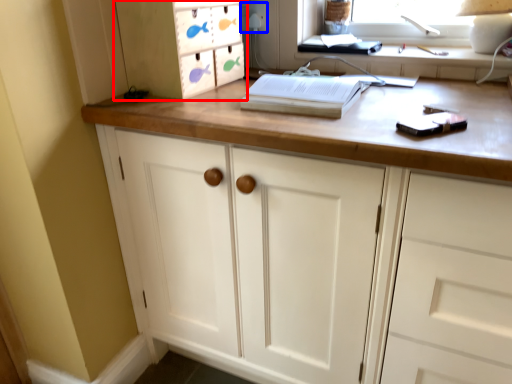
Question: Which of the following is the closest to the observer, cabinetry (highlighted by a red box) or electric outlet (highlighted by a blue box)?

Choices:
 (A) cabinetry
 (B) electric outlet

Answer: (A)